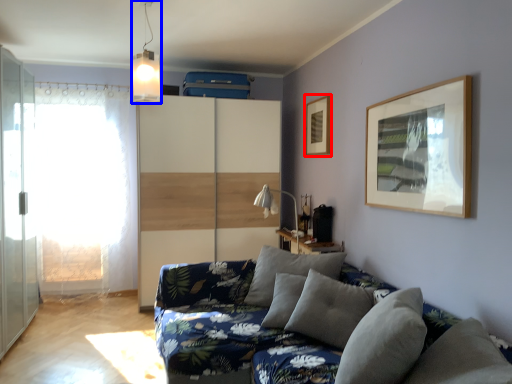
Question: Among these objects, which one is farthest to the camera, picture frame (highlighted by a red box) or light fixture (highlighted by a blue box)?

Choices:
 (A) picture frame
 (B) light fixture

Answer: (A)